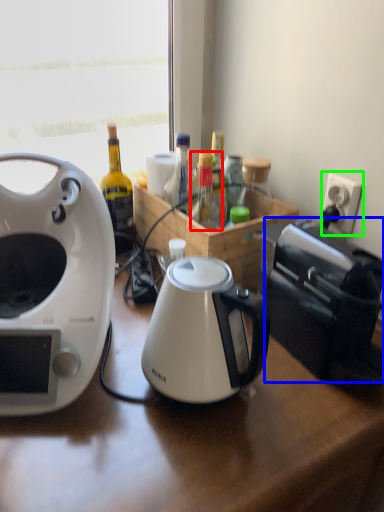
Question: Estimate the real-world distances between objects in this image. Which object is closer to bottle (highlighted by a red box), toaster (highlighted by a blue box) or power outlet (highlighted by a green box)?

Choices:
 (A) toaster
 (B) power outlet

Answer: (A)